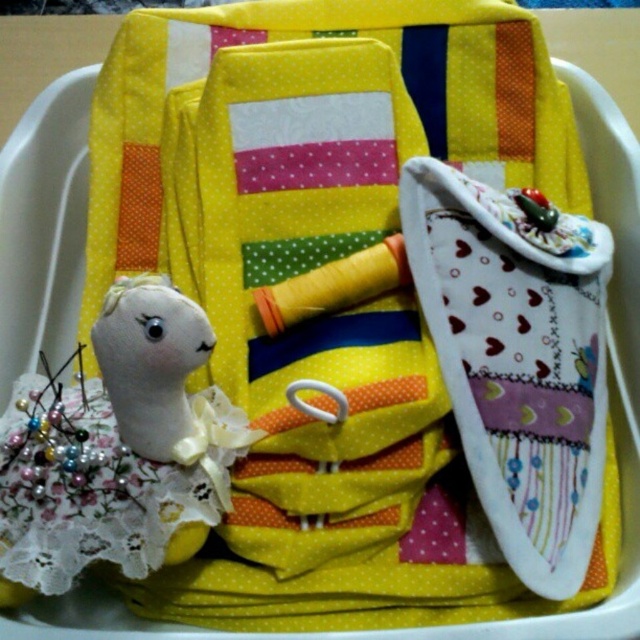
Between white lace doll at lower left and white fabric doll at lower left, which one appears on the right side from the viewer's perspective?

Positioned to the right is white fabric doll at lower left.

Who is more forward, (102, 550) or (140, 300)?

Point (140, 300) is more forward.

I want to click on white lace doll at lower left, so click(116, 445).